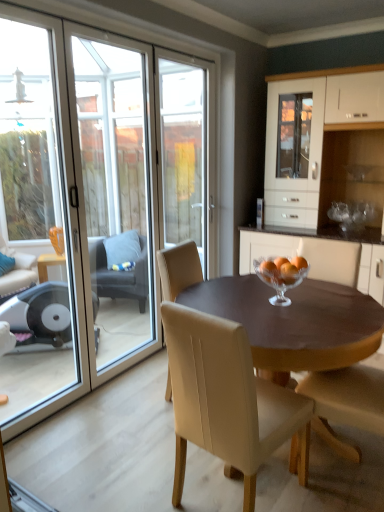
Question: Is white glossy cabinet at center taller than transparent glass screen door at left?

Choices:
 (A) no
 (B) yes

Answer: (A)

Question: Is white glossy cabinet at center further to the viewer compared to transparent glass screen door at left?

Choices:
 (A) yes
 (B) no

Answer: (A)

Question: Would you say white glossy cabinet at center contains transparent glass screen door at left?

Choices:
 (A) yes
 (B) no

Answer: (B)

Question: From the image's perspective, is white glossy cabinet at center located beneath transparent glass screen door at left?

Choices:
 (A) no
 (B) yes

Answer: (A)

Question: Is white glossy cabinet at center thinner than transparent glass screen door at left?

Choices:
 (A) yes
 (B) no

Answer: (B)

Question: Considering the relative sizes of white glossy cabinet at center and transparent glass screen door at left in the image provided, is white glossy cabinet at center shorter than transparent glass screen door at left?

Choices:
 (A) no
 (B) yes

Answer: (B)

Question: Considering the relative sizes of transparent glass door at left and beige leather chair at center, acting as the 2th chair starting from the front, in the image provided, is transparent glass door at left smaller than beige leather chair at center, acting as the 2th chair starting from the front,?

Choices:
 (A) yes
 (B) no

Answer: (B)

Question: Does transparent glass door at left have a lesser height compared to beige leather chair at center, which is counted as the 4th chair, starting from the left?

Choices:
 (A) no
 (B) yes

Answer: (A)

Question: Is transparent glass door at left positioned in front of beige leather chair at center, arranged as the first chair when viewed from the right?

Choices:
 (A) yes
 (B) no

Answer: (A)

Question: Is beige leather chair at center, which is counted as the 4th chair, starting from the left, located within transparent glass door at left?

Choices:
 (A) yes
 (B) no

Answer: (B)

Question: Could you tell me if transparent glass door at left is turned towards beige leather chair at center, which is counted as the 4th chair, starting from the left?

Choices:
 (A) yes
 (B) no

Answer: (A)

Question: Is transparent glass door at left outside of beige leather chair at center, arranged as the third chair when viewed from the back?

Choices:
 (A) no
 (B) yes

Answer: (B)

Question: Is transparent glass screen door at left surrounding beige leather chair at center, which is counted as the 2th chair, starting from the left?

Choices:
 (A) yes
 (B) no

Answer: (B)